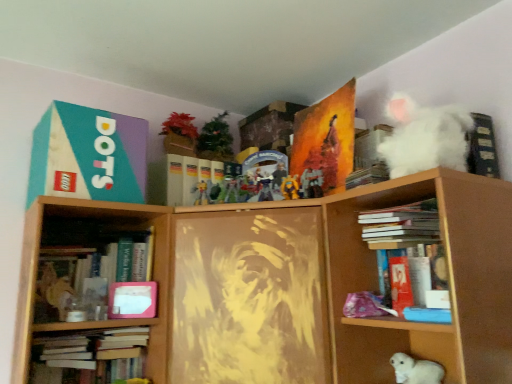
Question: Does yellow matte toy at center, which ranks as the fourth toy in bottom-to-top order, have a lesser width compared to hardcover book at left, the second book when ordered from left to right?

Choices:
 (A) yes
 (B) no

Answer: (A)

Question: Does yellow matte toy at center, which ranks as the fourth toy in bottom-to-top order, come in front of hardcover book at left, the second book when ordered from left to right?

Choices:
 (A) no
 (B) yes

Answer: (A)

Question: From a real-world perspective, does yellow matte toy at center, marked as the third toy in a left-to-right arrangement, stand above hardcover book at left, the 2th book ordered from the bottom?

Choices:
 (A) no
 (B) yes

Answer: (B)

Question: Is hardcover book at left, which ranks as the 4th book in right-to-left order, completely or partially inside yellow matte toy at center, marked as the third toy in a left-to-right arrangement?

Choices:
 (A) yes
 (B) no

Answer: (B)

Question: Can you confirm if yellow matte toy at center, which ranks as the fourth toy in bottom-to-top order, is positioned to the left of hardcover book at left, which ranks as the 4th book in right-to-left order?

Choices:
 (A) yes
 (B) no

Answer: (B)

Question: From their relative heights in the image, would you say shiny plastic action figure at center, placed as the second toy when sorted from left to right, is taller or shorter than yellow matte toy at center, marked as the third toy in a left-to-right arrangement?

Choices:
 (A) short
 (B) tall

Answer: (B)

Question: Choose the correct answer: Is shiny plastic action figure at center, the second toy positioned from the back, inside yellow matte toy at center, placed as the 2th toy when sorted from right to left, or outside it?

Choices:
 (A) outside
 (B) inside

Answer: (A)

Question: Considering the positions of point (225, 192) and point (285, 185), is point (225, 192) closer or farther from the camera than point (285, 185)?

Choices:
 (A) farther
 (B) closer

Answer: (A)

Question: From a real-world perspective, is shiny plastic action figure at center, placed as the second toy when sorted from left to right, positioned above or below yellow matte toy at center, acting as the first toy starting from the top?

Choices:
 (A) below
 (B) above

Answer: (A)

Question: Visually, is yellow matte toy at center, marked as the third toy in a left-to-right arrangement, positioned to the left or to the right of white matte book at upper right, which is counted as the third book, starting from the top?

Choices:
 (A) left
 (B) right

Answer: (A)

Question: Is yellow matte toy at center, the 2th toy positioned from the front, bigger or smaller than white matte book at upper right, arranged as the 1th book when viewed from the right?

Choices:
 (A) big
 (B) small

Answer: (B)

Question: In terms of width, does yellow matte toy at center, acting as the first toy starting from the top, look wider or thinner when compared to white matte book at upper right, acting as the 5th book starting from the left?

Choices:
 (A) thin
 (B) wide

Answer: (A)

Question: Relative to white matte book at upper right, acting as the 5th book starting from the left, is yellow matte toy at center, placed as the 2th toy when sorted from right to left, in front or behind?

Choices:
 (A) front
 (B) behind

Answer: (B)

Question: Looking at the image, does orange matte painting at upper center, acting as the second paperback book starting from the left, seem bigger or smaller compared to matte plastic action figure at center, the 2th toy in the bottom-to-top sequence?

Choices:
 (A) big
 (B) small

Answer: (A)

Question: In the image, is orange matte painting at upper center, acting as the second paperback book starting from the left, on the left side or the right side of matte plastic action figure at center, the 2th toy in the bottom-to-top sequence?

Choices:
 (A) left
 (B) right

Answer: (B)